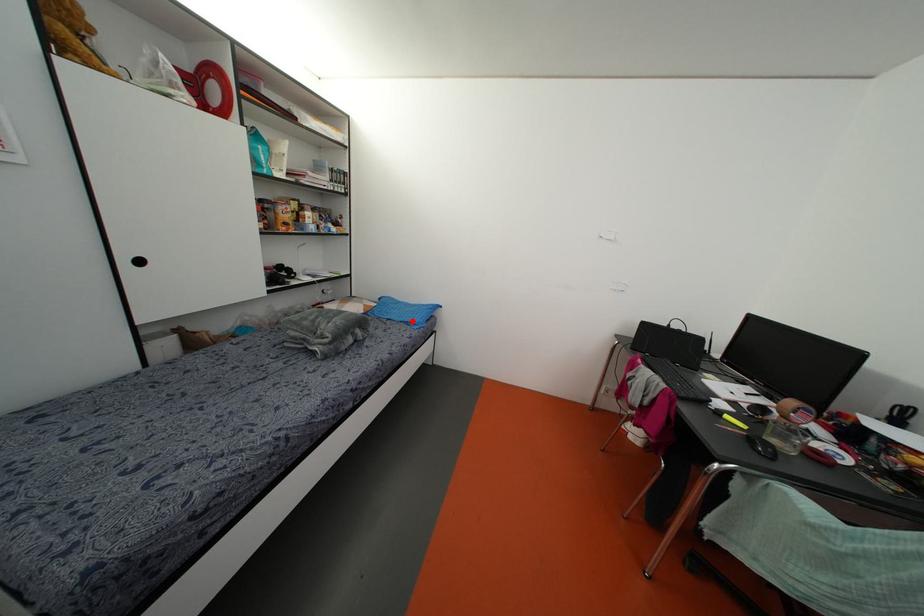
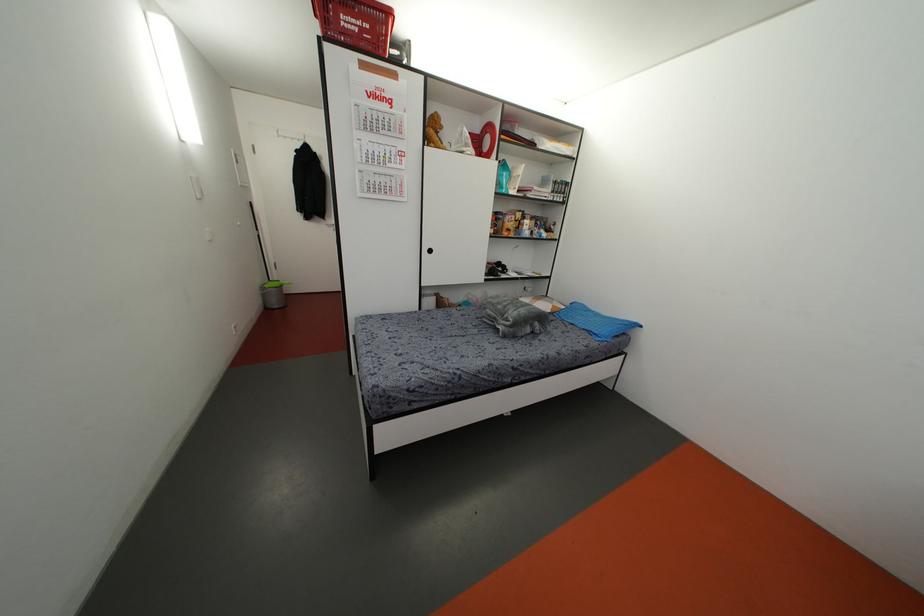
Find the pixel in the second image that matches the highlighted location in the first image.

(596, 331)